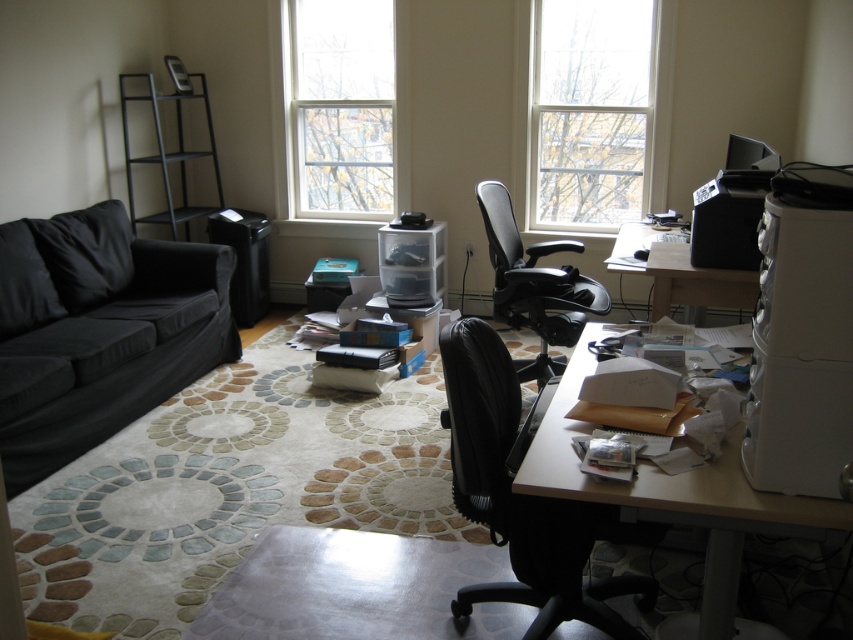
Question: Does black fabric couch at left lie behind wooden desk at center?

Choices:
 (A) yes
 (B) no

Answer: (B)

Question: Which point is farther to the camera?

Choices:
 (A) black fabric couch at left
 (B) wooden desk at center
 (C) wooden desk at lower right
 (D) transparent glass window at upper center

Answer: (D)

Question: Which object is the closest to the wooden desk at center?

Choices:
 (A) transparent glass window at upper center
 (B) black mesh office chair at center
 (C) black mesh swivel chair at center

Answer: (B)

Question: Can you confirm if transparent glass window at upper center is positioned below white frame window at upper center?

Choices:
 (A) no
 (B) yes

Answer: (B)

Question: Where is transparent glass window at upper center located in relation to wooden desk at center in the image?

Choices:
 (A) right
 (B) left

Answer: (A)

Question: Which point is closer to the camera taking this photo?

Choices:
 (A) (666, 253)
 (B) (566, 320)
 (C) (454, 490)

Answer: (C)